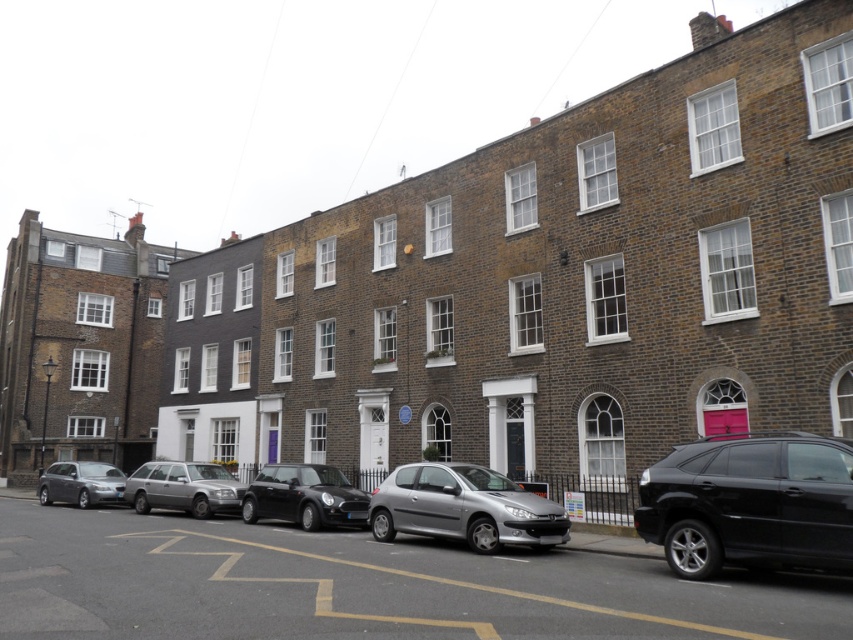
You are standing on the street in front of the terraced houses. You notice two points marked on the image. The first point is at coordinates point (834, 556) and the second is at point (473, 465). Which point is closer to you?

The point at coordinates point (834, 556) is closer to you than the point at point (473, 465).